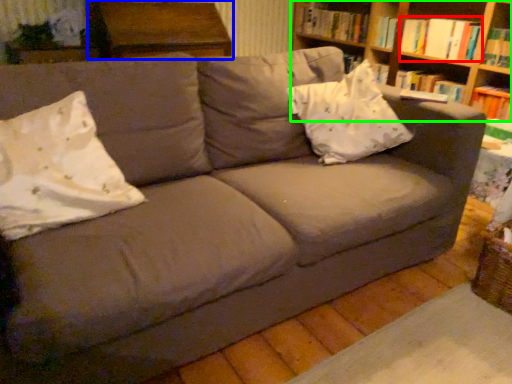
Question: Which is nearer to the book (highlighted by a red box)? table (highlighted by a blue box) or shelf (highlighted by a green box).

Choices:
 (A) table
 (B) shelf

Answer: (B)